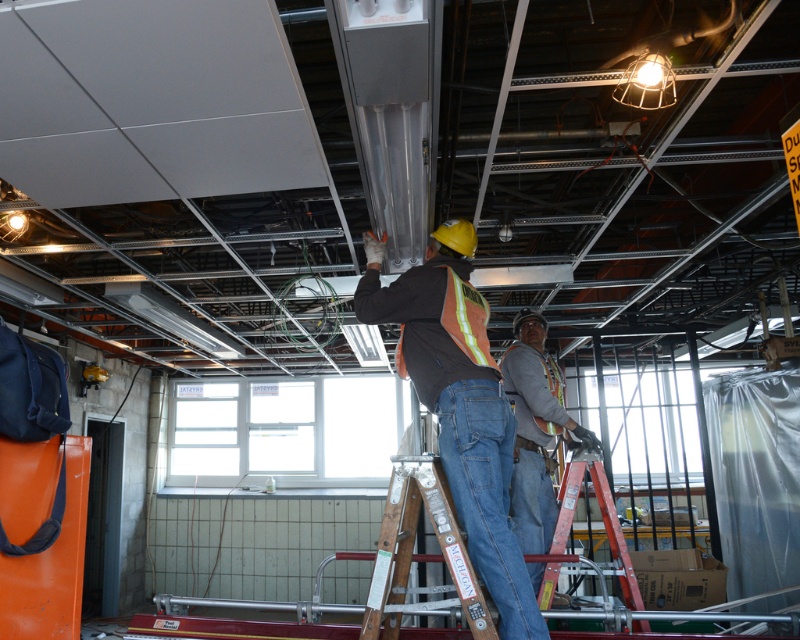
Does reflective orange safety vest at center appear under orange safety vest at center?

No.

Is reflective orange safety vest at center above orange safety vest at center?

Indeed, reflective orange safety vest at center is positioned over orange safety vest at center.

Between point (456, 262) and point (558, 401), which one is positioned behind?

Point (558, 401)

You are a GUI agent. You are given a task and a screenshot of the screen. Output one action in this format:
    pyautogui.click(x=<x>, y=<y>)
    Task: Click on the reflective orange safety vest at center
    This screenshot has height=640, width=800.
    Given the screenshot: What is the action you would take?
    pyautogui.click(x=458, y=403)

Can you confirm if orange safety vest at center is taller than metallic red ladder at center?

Correct, orange safety vest at center is much taller as metallic red ladder at center.

Is orange safety vest at center shorter than metallic red ladder at center?

In fact, orange safety vest at center may be taller than metallic red ladder at center.

I want to click on orange safety vest at center, so click(534, 429).

This screenshot has width=800, height=640. I want to click on orange safety vest at center, so click(x=534, y=429).

Does reflective orange safety vest at center have a lesser width compared to metallic red ladder at center?

No.

What do you see at coordinates (458, 403) in the screenshot? The height and width of the screenshot is (640, 800). I see `reflective orange safety vest at center` at bounding box center [458, 403].

Which is behind, point (533, 611) or point (552, 589)?

Point (552, 589)

This screenshot has width=800, height=640. Identify the location of reflective orange safety vest at center. (458, 403).